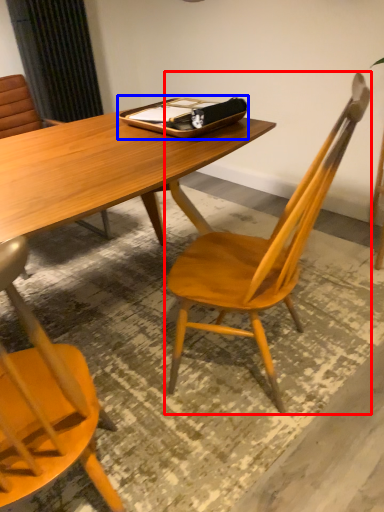
Question: Which of the following is the farthest to the observer, chair (highlighted by a red box) or tray (highlighted by a blue box)?

Choices:
 (A) chair
 (B) tray

Answer: (B)